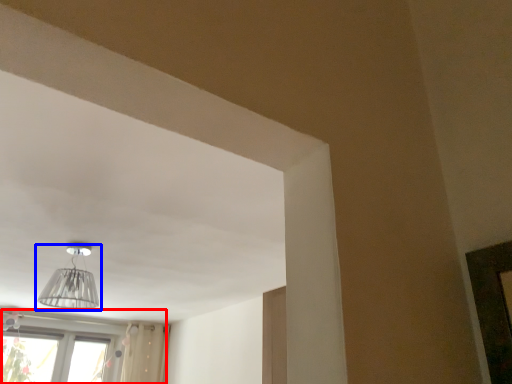
Question: Among these objects, which one is farthest to the camera, window (highlighted by a red box) or lamp (highlighted by a blue box)?

Choices:
 (A) window
 (B) lamp

Answer: (A)